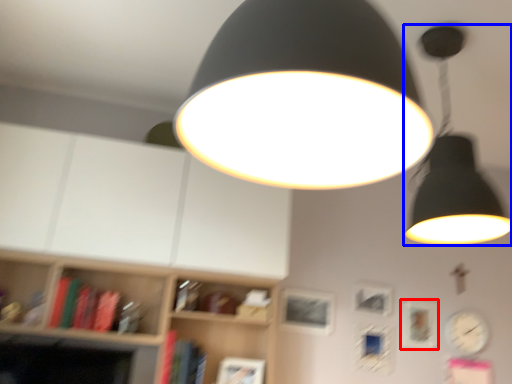
Question: Which of the following is the closest to the observer, picture frame (highlighted by a red box) or lamp (highlighted by a blue box)?

Choices:
 (A) picture frame
 (B) lamp

Answer: (B)